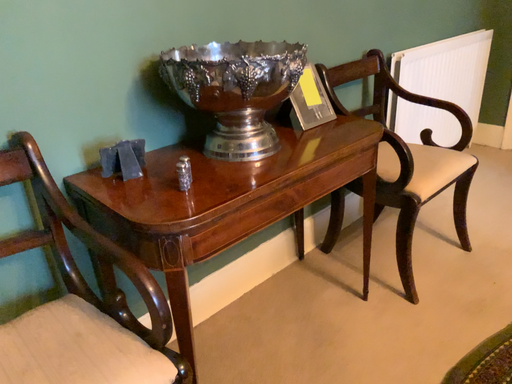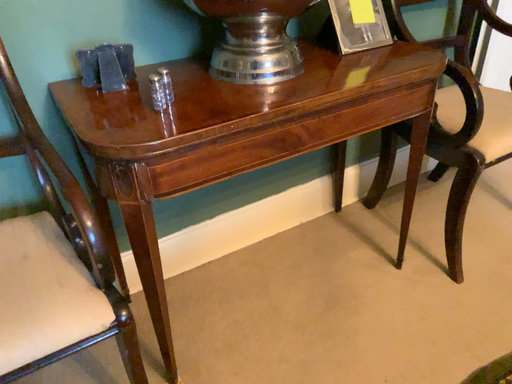
Question: Which way did the camera rotate in the video?

Choices:
 (A) rotated upward
 (B) rotated downward

Answer: (B)